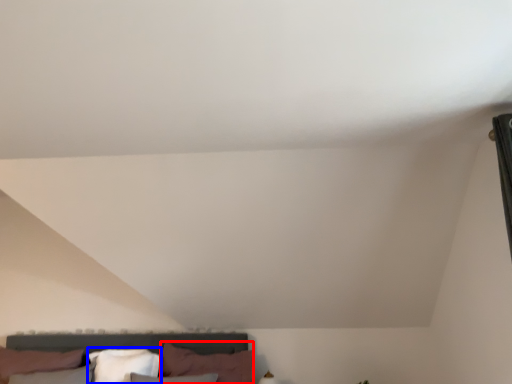
Question: Which object is closer to the camera taking this photo, pillow (highlighted by a red box) or pillow (highlighted by a blue box)?

Choices:
 (A) pillow
 (B) pillow

Answer: (A)